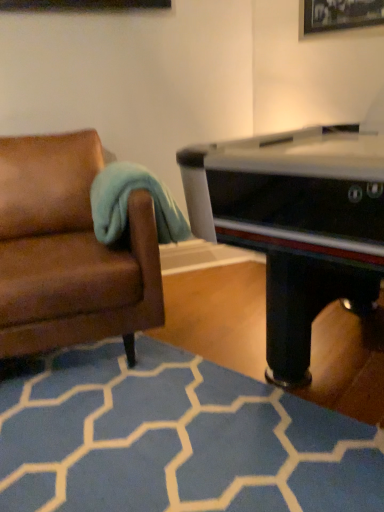
I want to click on blue carpet at lower center, so click(x=175, y=439).

Describe the element at coordinates (175, 439) in the screenshot. This screenshot has height=512, width=384. I see `blue carpet at lower center` at that location.

Find the location of `brown leather couch at left`. brown leather couch at left is located at coordinates (69, 252).

This screenshot has width=384, height=512. I want to click on blue carpet at lower center, so click(175, 439).

Is brown leather couch at left at the back of blue carpet at lower center?

No, brown leather couch at left is not at the back of blue carpet at lower center.

The width and height of the screenshot is (384, 512). In order to click on plain directly beneath the brown leather couch at left (from a real-world perspective) in this screenshot , I will do `click(175, 439)`.

Considering the points (175, 452) and (4, 208), which point is in front, point (175, 452) or point (4, 208)?

The point (175, 452) is more forward.

Is teal soft fabric at left far from blue carpet at lower center?

teal soft fabric at left is actually quite close to blue carpet at lower center.

Considering the positions of objects teal soft fabric at left and blue carpet at lower center in the image provided, who is behind, teal soft fabric at left or blue carpet at lower center?

teal soft fabric at left is further from the camera.

How many degrees apart are the facing directions of teal soft fabric at left and blue carpet at lower center?

The angle between the facing direction of teal soft fabric at left and the facing direction of blue carpet at lower center is 56.2 degrees.

Between teal soft fabric at left and blue carpet at lower center, which one appears on the left side from the viewer's perspective?

From the viewer's perspective, teal soft fabric at left appears more on the left side.

From the image's perspective, is teal soft fabric at left above or below brown leather couch at left?

teal soft fabric at left is above brown leather couch at left.

Is teal soft fabric at left oriented towards brown leather couch at left?

Yes, teal soft fabric at left is turned towards brown leather couch at left.

Is point (117, 162) farther from viewer compared to point (45, 247)?

Yes.

Can you confirm if teal soft fabric at left is bigger than brown leather couch at left?

No, teal soft fabric at left is not bigger than brown leather couch at left.

Which object is closer to the camera taking this photo, brown leather couch at left or blue carpet at lower center?

blue carpet at lower center is closer to the camera.

Is point (117, 333) less distant than point (226, 505)?

No, (117, 333) is behind (226, 505).

Is brown leather couch at left aimed at blue carpet at lower center?

Yes, brown leather couch at left is facing blue carpet at lower center.

Measure the distance between blue carpet at lower center and teal soft fabric at left.

blue carpet at lower center and teal soft fabric at left are 26.08 inches apart from each other.

Is point (121, 384) behind point (119, 196)?

Yes, it is.

Is blue carpet at lower center far away from teal soft fabric at left?

blue carpet at lower center is near teal soft fabric at left, not far away.

Is blue carpet at lower center in front of teal soft fabric at left?

Yes, blue carpet at lower center is in front of teal soft fabric at left.

Is the depth of brown leather couch at left less than that of teal soft fabric at left?

Yes, brown leather couch at left is in front of teal soft fabric at left.

From a real-world perspective, is brown leather couch at left positioned above or below teal soft fabric at left?

In terms of real-world spatial position, brown leather couch at left is below teal soft fabric at left.

Considering the sizes of objects brown leather couch at left and teal soft fabric at left in the image provided, who is bigger, brown leather couch at left or teal soft fabric at left?

With larger size is brown leather couch at left.

Does brown leather couch at left turn towards teal soft fabric at left?

No, brown leather couch at left is not facing towards teal soft fabric at left.

I want to click on plain located below the brown leather couch at left (from the image's perspective), so click(x=175, y=439).

This screenshot has height=512, width=384. I want to click on blanket located behind the blue carpet at lower center, so click(x=127, y=204).

From the image, which object appears to be farther from teal soft fabric at left, brown leather couch at left or blue carpet at lower center?

blue carpet at lower center.

Looking at the image, which one is located further to blue carpet at lower center, brown leather couch at left or teal soft fabric at left?

Among the two, teal soft fabric at left is located further to blue carpet at lower center.

Considering their positions, is teal soft fabric at left positioned further to brown leather couch at left than blue carpet at lower center?

blue carpet at lower center.

From the image, which object appears to be farther from blue carpet at lower center, teal soft fabric at left or brown leather couch at left?

Based on the image, teal soft fabric at left appears to be further to blue carpet at lower center.

Looking at the image, which one is located further to brown leather couch at left, blue carpet at lower center or teal soft fabric at left?

blue carpet at lower center.

From the image, which object appears to be farther from teal soft fabric at left, blue carpet at lower center or brown leather couch at left?

blue carpet at lower center.

Locate an element on the screen. This screenshot has width=384, height=512. studio couch that lies between teal soft fabric at left and blue carpet at lower center from top to bottom is located at coordinates point(69,252).